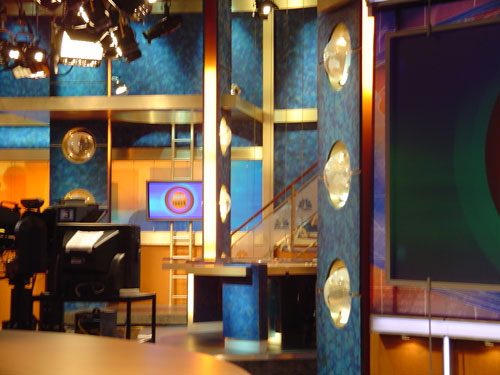
At what (x,y) coordinates should I click in order to perform the action: click on ladder. Please return your answer as a coordinate pair (x, y). The height and width of the screenshot is (375, 500). Looking at the image, I should click on [x=182, y=258].